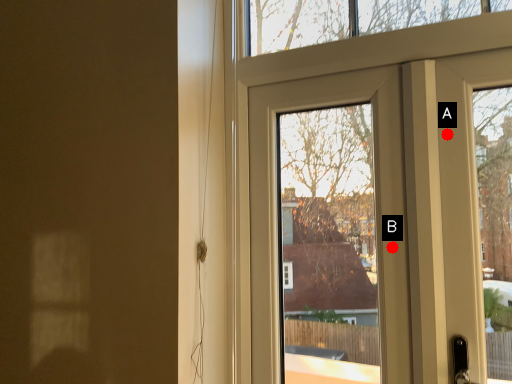
Question: Two points are circled on the image, labeled by A and B beside each circle. Which point appears farthest from the camera in this image?

Choices:
 (A) A is further
 (B) B is further

Answer: (B)